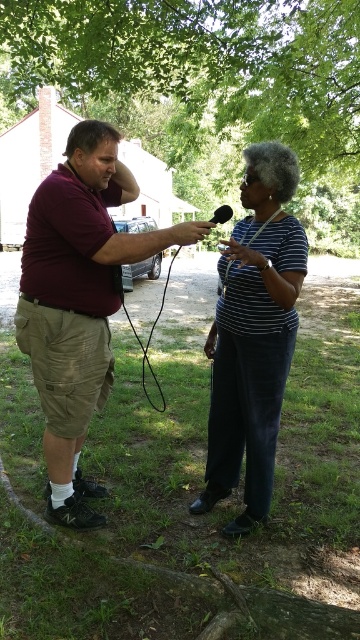
Does maroon shirt at left have a greater height compared to striped fabric shirt at center?

Correct, maroon shirt at left is much taller as striped fabric shirt at center.

Does maroon shirt at left have a lesser width compared to striped fabric shirt at center?

No, maroon shirt at left is not thinner than striped fabric shirt at center.

Where is `maroon shirt at left`? The width and height of the screenshot is (360, 640). maroon shirt at left is located at coordinates (78, 300).

Is the position of striped fabric shirt at center less distant than that of black matte microphone at center?

That is True.

Is the position of striped fabric shirt at center more distant than that of black matte microphone at center?

No, striped fabric shirt at center is closer to the viewer.

This screenshot has height=640, width=360. Find the location of `striped fabric shirt at center`. striped fabric shirt at center is located at coordinates (254, 333).

Where is `striped fabric shirt at center`? This screenshot has height=640, width=360. striped fabric shirt at center is located at coordinates (254, 333).

Which is behind, point (123, 88) or point (249, 147)?

Positioned behind is point (123, 88).

Who is shorter, green leafy tree at upper center or striped fabric shirt at center?

Standing shorter between the two is striped fabric shirt at center.

Where is `green leafy tree at upper center`? green leafy tree at upper center is located at coordinates (209, 83).